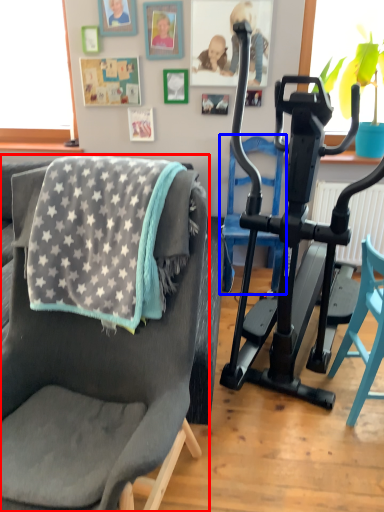
Question: Which of the following is the farthest to the observer, chair (highlighted by a red box) or armchair (highlighted by a blue box)?

Choices:
 (A) chair
 (B) armchair

Answer: (B)